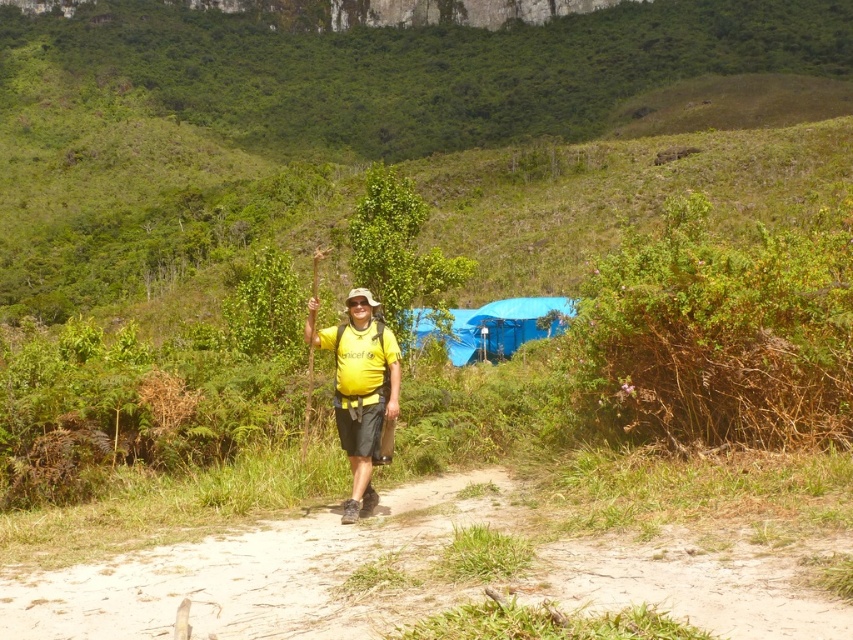
Does green leafy bush at right have a greater height compared to yellow matte shirt at center?

Correct, green leafy bush at right is much taller as yellow matte shirt at center.

Does point (682, 445) lie behind point (344, 336)?

No, (682, 445) is closer to viewer.

Who is more forward, (628,356) or (361,440)?

Point (361,440)

Locate an element on the screen. The height and width of the screenshot is (640, 853). green leafy bush at right is located at coordinates (718, 333).

Is dirt path at center further to camera compared to yellow matte shirt at center?

No.

Is point (669, 596) positioned behind point (367, 490)?

No.

Measure the distance between point (769, 582) and camera.

52.93 feet

The height and width of the screenshot is (640, 853). I want to click on dirt path at center, so click(276, 572).

Does dirt path at center have a lesser width compared to green leafy bush at right?

Yes, dirt path at center is thinner than green leafy bush at right.

Between dirt path at center and green leafy bush at right, which one has more height?

Standing taller between the two is green leafy bush at right.

Is point (744, 541) less distant than point (844, 429)?

Yes, it is in front of point (844, 429).

Find the location of a particular element. dirt path at center is located at coordinates (276, 572).